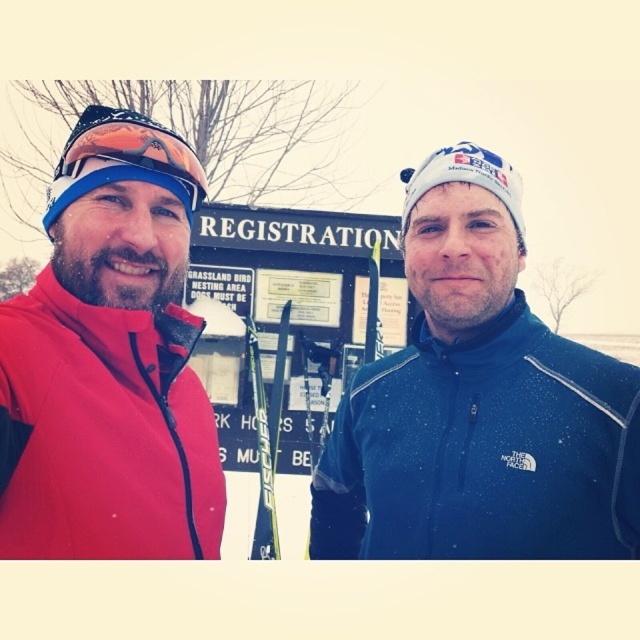
Can you confirm if blue fleece jacket at center is shorter than matte red jacket at left?

Correct, blue fleece jacket at center is not as tall as matte red jacket at left.

Is point (554, 492) behind point (61, 317)?

No.

You are a GUI agent. You are given a task and a screenshot of the screen. Output one action in this format:
    pyautogui.click(x=<x>, y=<y>)
    Task: Click on the blue fleece jacket at center
    Image resolution: width=640 pixels, height=640 pixels.
    Given the screenshot: What is the action you would take?
    pyautogui.click(x=477, y=404)

This screenshot has height=640, width=640. Identify the location of blue fleece jacket at center. (477, 404).